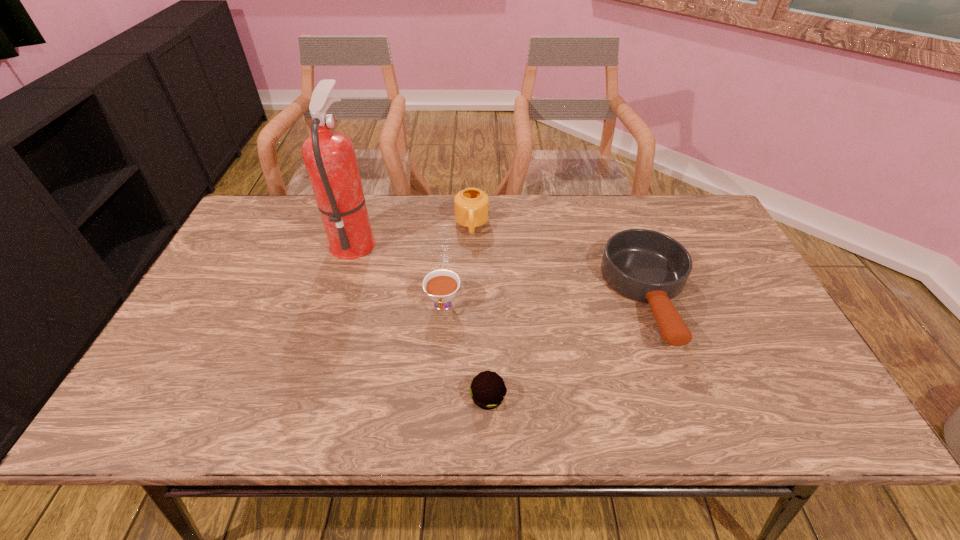
Locate an element on the screen. The image size is (960, 540). free space between the teacup and the rightmost object is located at coordinates (546, 301).

At what (x,y) coordinates should I click in order to perform the action: click on object identified as the second closest to the mug. Please return your answer as a coordinate pair (x, y). Looking at the image, I should click on (329, 156).

Locate which object is the second closest to the teacup. Please provide its 2D coordinates. Your answer should be formatted as a tuple, i.e. [(x, y)], where the tuple contains the x and y coordinates of a point satisfying the conditions above.

[(329, 156)]

I want to click on free space that satisfies the following two spatial constraints: 1. on the handle side of the mug; 2. on the left side of the patty, so click(x=468, y=397).

I want to click on blank space that satisfies the following two spatial constraints: 1. with the handle and hose on the leftmost object; 2. on the left side of the shortest object, so click(x=304, y=397).

Find the location of a particular element. The height and width of the screenshot is (540, 960). vacant region that satisfies the following two spatial constraints: 1. with the handle and hose on the nearest object; 2. on the left side of the leftmost object is located at coordinates (304, 397).

Where is `vacant space that satisfies the following two spatial constraints: 1. on the handle side of the shortest object; 2. on the right side of the second tallest object`? vacant space that satisfies the following two spatial constraints: 1. on the handle side of the shortest object; 2. on the right side of the second tallest object is located at coordinates (468, 397).

At what (x,y) coordinates should I click in order to perform the action: click on free space that satisfies the following two spatial constraints: 1. on the handle side of the second tallest object; 2. with the handle and hose on the tallest object. Please return your answer as a coordinate pair (x, y). The height and width of the screenshot is (540, 960). Looking at the image, I should click on (471, 240).